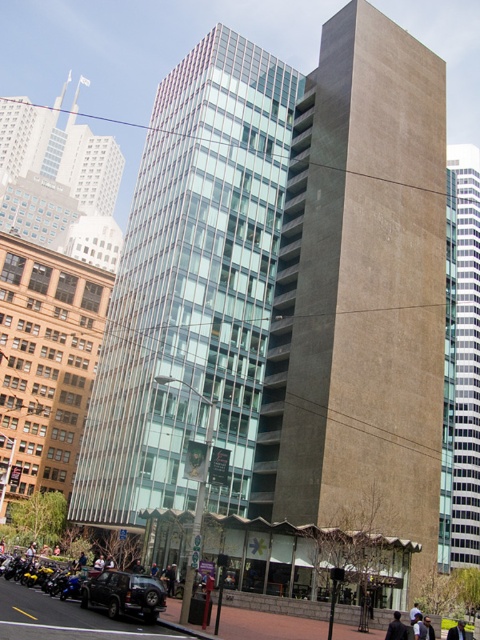
Question: Which point is closer to the camera taking this photo?

Choices:
 (A) (105, 586)
 (B) (64, 582)
 (C) (276, 420)
 (D) (460, 490)

Answer: (A)

Question: Does glassy steel building at center appear on the right side of shiny blue motorcycle at lower left?

Choices:
 (A) yes
 (B) no

Answer: (A)

Question: Is glassy steel building at center in front of dark gray jacket at center?

Choices:
 (A) no
 (B) yes

Answer: (A)

Question: Among these objects, which one is nearest to the camera?

Choices:
 (A) brown concrete tower at center
 (B) dark gray jacket at center

Answer: (B)

Question: Which object is positioned farthest from the dark gray jacket at center?

Choices:
 (A) glassy steel building at center
 (B) dark gray suit at center
 (C) matte black suv at lower left

Answer: (A)

Question: Is matte black suv at lower left above shiny blue motorcycle at lower left?

Choices:
 (A) yes
 (B) no

Answer: (A)